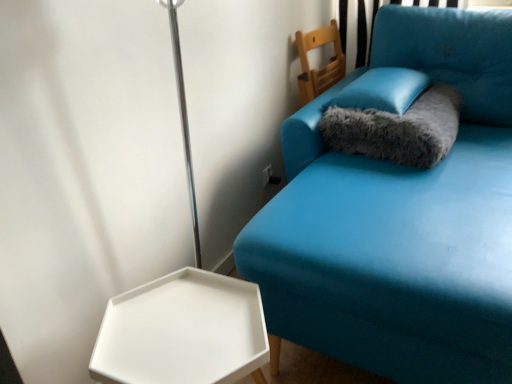
Question: Does white matte hexagonal tray at lower left have a greater height compared to teal fabric couch at upper right?

Choices:
 (A) yes
 (B) no

Answer: (B)

Question: Is white matte hexagonal tray at lower left positioned with its back to teal fabric couch at upper right?

Choices:
 (A) yes
 (B) no

Answer: (B)

Question: Is white matte hexagonal tray at lower left not near teal fabric couch at upper right?

Choices:
 (A) no
 (B) yes

Answer: (A)

Question: Is white matte hexagonal tray at lower left directly adjacent to teal fabric couch at upper right?

Choices:
 (A) yes
 (B) no

Answer: (B)

Question: From a real-world perspective, is white matte hexagonal tray at lower left located higher than teal fabric couch at upper right?

Choices:
 (A) no
 (B) yes

Answer: (A)

Question: In terms of width, does satin blue pillow at upper right look wider or thinner when compared to wooden chair at upper center?

Choices:
 (A) thin
 (B) wide

Answer: (B)

Question: Visually, is satin blue pillow at upper right positioned to the left or to the right of wooden chair at upper center?

Choices:
 (A) right
 (B) left

Answer: (A)

Question: In the image, is satin blue pillow at upper right positioned in front of or behind wooden chair at upper center?

Choices:
 (A) front
 (B) behind

Answer: (A)

Question: From the image's perspective, is satin blue pillow at upper right above or below wooden chair at upper center?

Choices:
 (A) below
 (B) above

Answer: (A)

Question: Is point (309, 72) positioned closer to the camera than point (106, 334)?

Choices:
 (A) farther
 (B) closer

Answer: (A)

Question: From the image's perspective, relative to white matte hexagonal tray at lower left, is wooden chair at upper center above or below?

Choices:
 (A) above
 (B) below

Answer: (A)

Question: Relative to white matte hexagonal tray at lower left, is wooden chair at upper center in front or behind?

Choices:
 (A) behind
 (B) front

Answer: (A)

Question: From a real-world perspective, relative to white matte hexagonal tray at lower left, is wooden chair at upper center vertically above or below?

Choices:
 (A) above
 (B) below

Answer: (A)

Question: From a real-world perspective, is teal fabric couch at upper right physically located above or below fuzzy gray cat bed at upper right?

Choices:
 (A) above
 (B) below

Answer: (B)

Question: From the image's perspective, is teal fabric couch at upper right above or below fuzzy gray cat bed at upper right?

Choices:
 (A) above
 (B) below

Answer: (B)